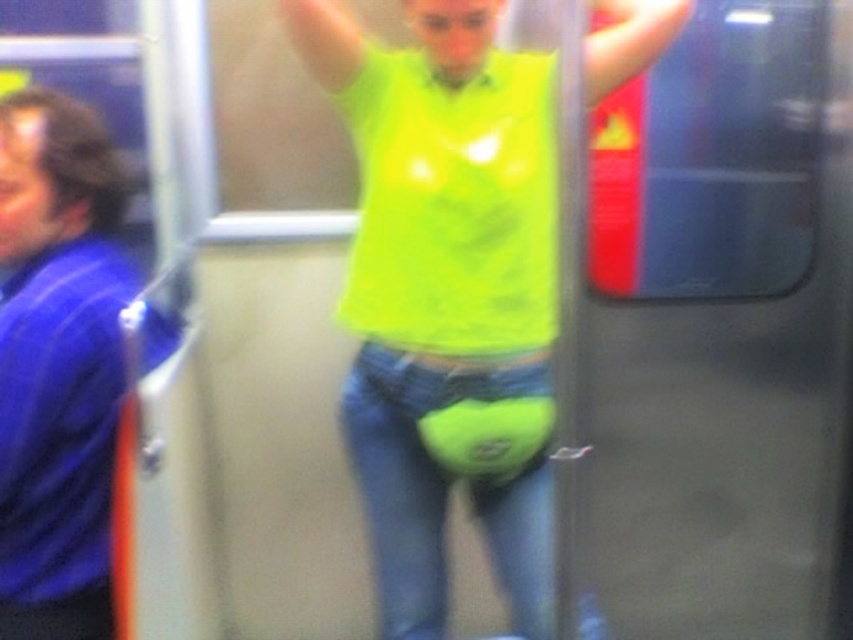
Question: Is neon yellow fabric at center thinner than blue fabric shirt at left?

Choices:
 (A) no
 (B) yes

Answer: (A)

Question: Can you confirm if neon yellow fabric at center is wider than blue fabric shirt at left?

Choices:
 (A) yes
 (B) no

Answer: (A)

Question: Observing the image, what is the correct spatial positioning of neon yellow fabric at center in reference to blue fabric shirt at left?

Choices:
 (A) above
 (B) below

Answer: (A)

Question: Which point appears closest to the camera in this image?

Choices:
 (A) (457, 173)
 (B) (88, 515)

Answer: (B)